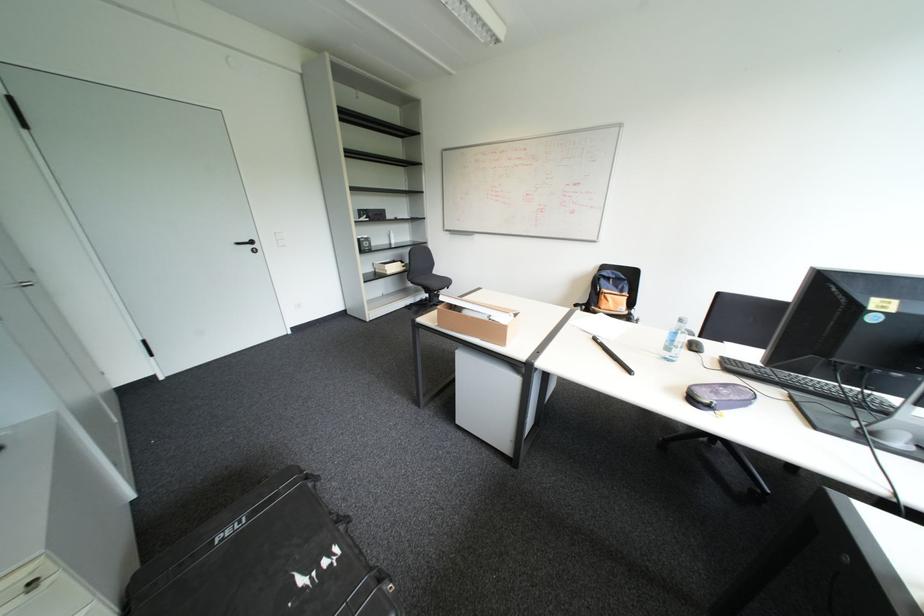
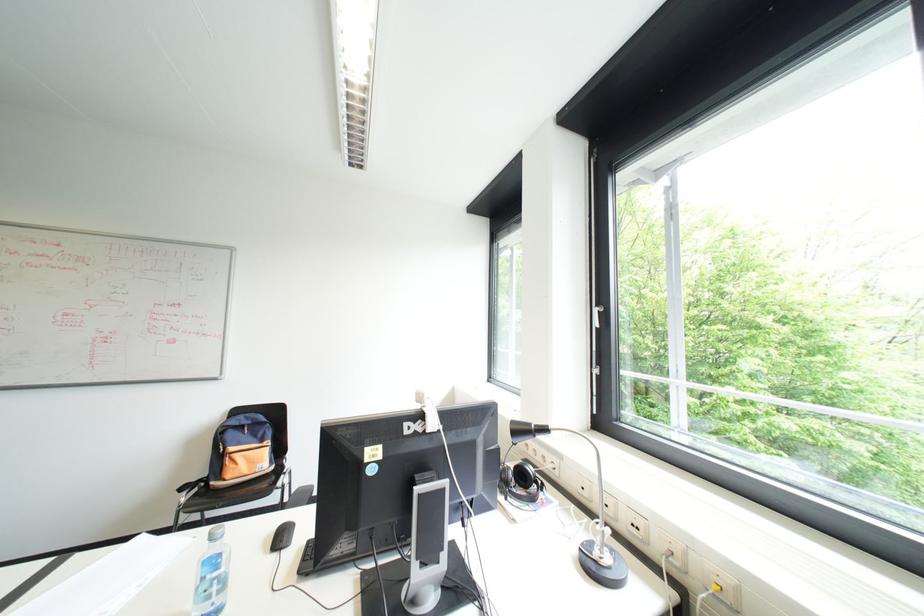
Question: The first image is from the beginning of the video and the second image is from the end. How did the camera likely rotate when shooting the video?

Choices:
 (A) Left
 (B) Right
 (C) Up
 (D) Down

Answer: (B)